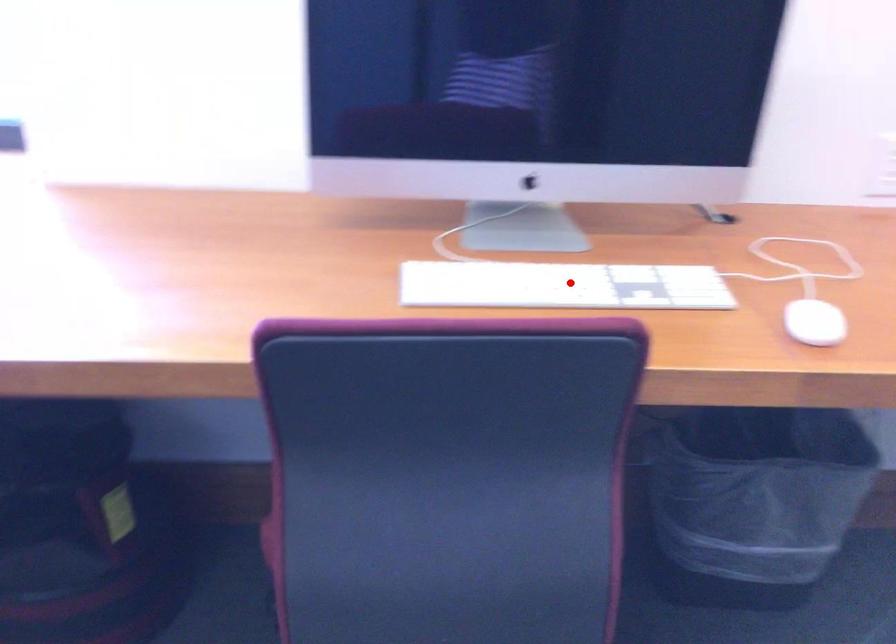
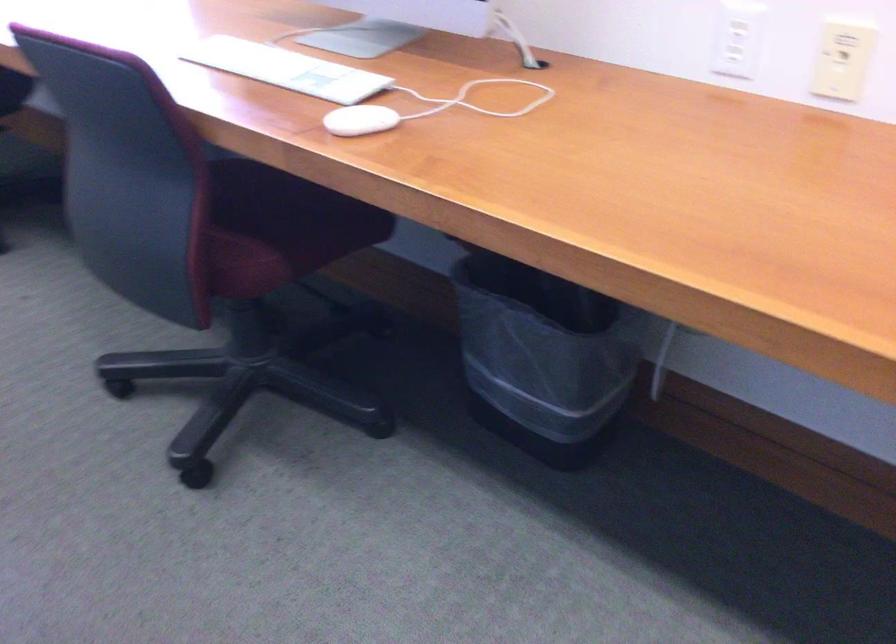
Question: I am providing you with two images of the same scene from different viewpoints. Image1 has a red point marked. In image2, the corresponding 3D location appears at what relative position? Reply with the corresponding letter.

Choices:
 (A) Closer
 (B) Farther

Answer: (B)